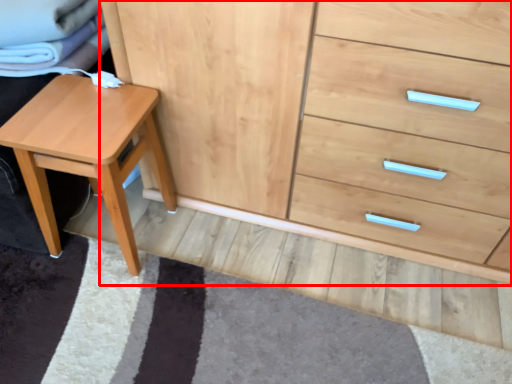
Question: In this image, where is chest of drawers (annotated by the red box) located relative to stool?

Choices:
 (A) left
 (B) right

Answer: (B)